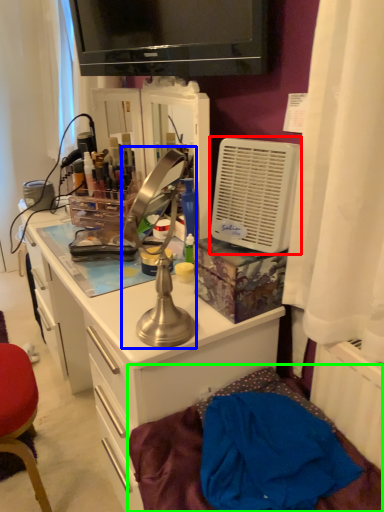
Question: Which object is positioned farthest from air conditioning (highlighted by a red box)? Select from table lamp (highlighted by a blue box) and bed (highlighted by a green box).

Choices:
 (A) table lamp
 (B) bed

Answer: (B)